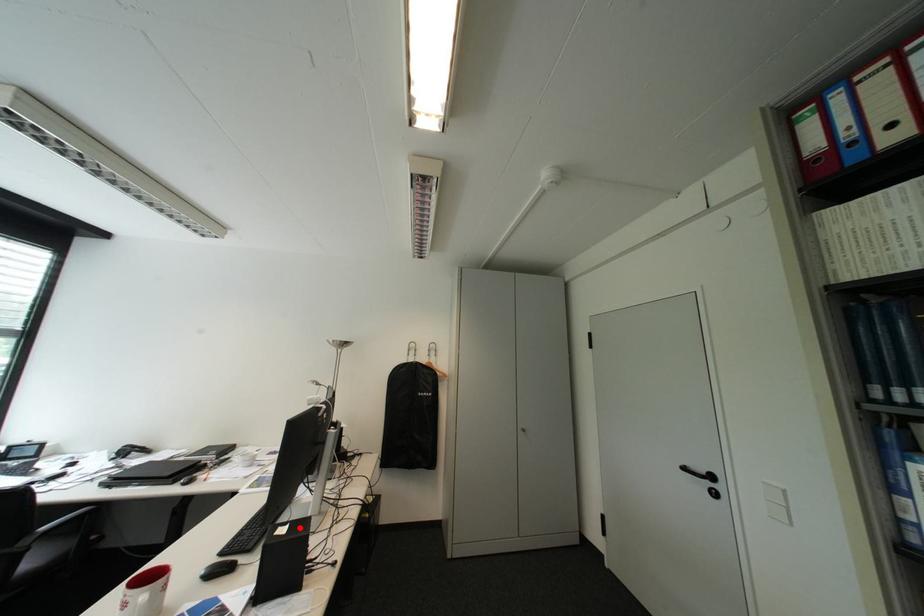
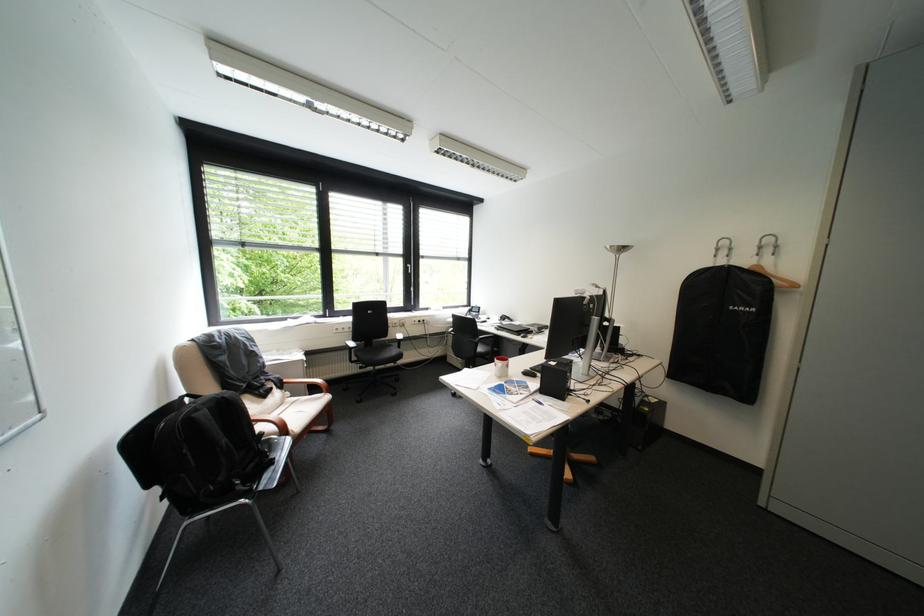
Locate, in the second image, the point that corresponds to the highlighted location in the first image.

(568, 363)